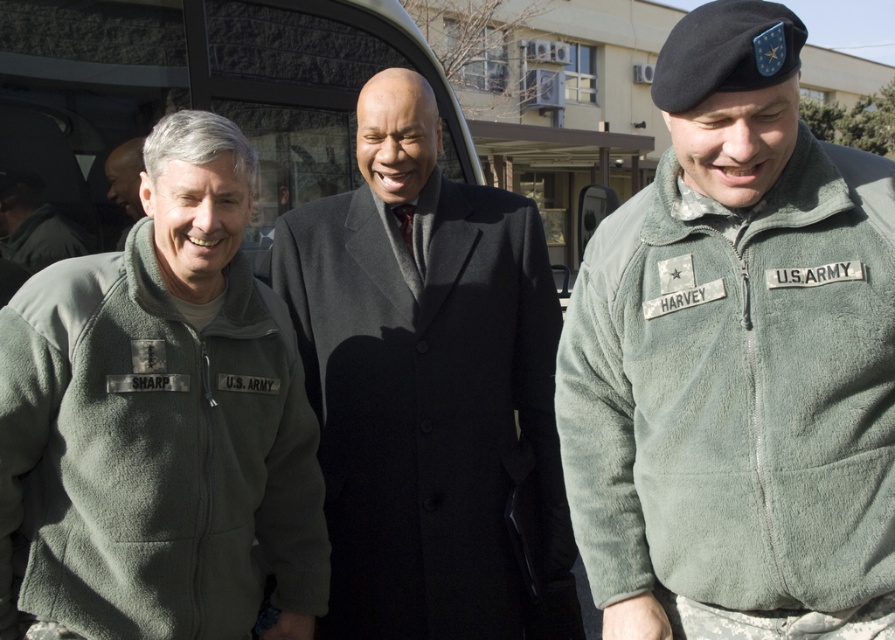
Question: Which object is the farthest from the metallic gray van at center?

Choices:
 (A) matte black coat at center
 (B) black wool coat at center
 (C) matte black jacket at left
 (D) sage fleece jacket at right

Answer: (D)

Question: Is black wool coat at center below matte black coat at center?

Choices:
 (A) no
 (B) yes

Answer: (B)

Question: Which of these objects is positioned closest to the matte black coat at center?

Choices:
 (A) black wool coat at center
 (B) matte green fleece jacket at left

Answer: (A)

Question: Is metallic gray van at center smaller than matte black jacket at left?

Choices:
 (A) yes
 (B) no

Answer: (B)

Question: Estimate the real-world distances between objects in this image. Which object is closer to the metallic gray van at center?

Choices:
 (A) matte black coat at center
 (B) black wool coat at center
 (C) sage fleece jacket at right
 (D) matte green fleece jacket at left

Answer: (A)

Question: Can you confirm if sage fleece jacket at right is positioned below metallic gray van at center?

Choices:
 (A) yes
 (B) no

Answer: (A)